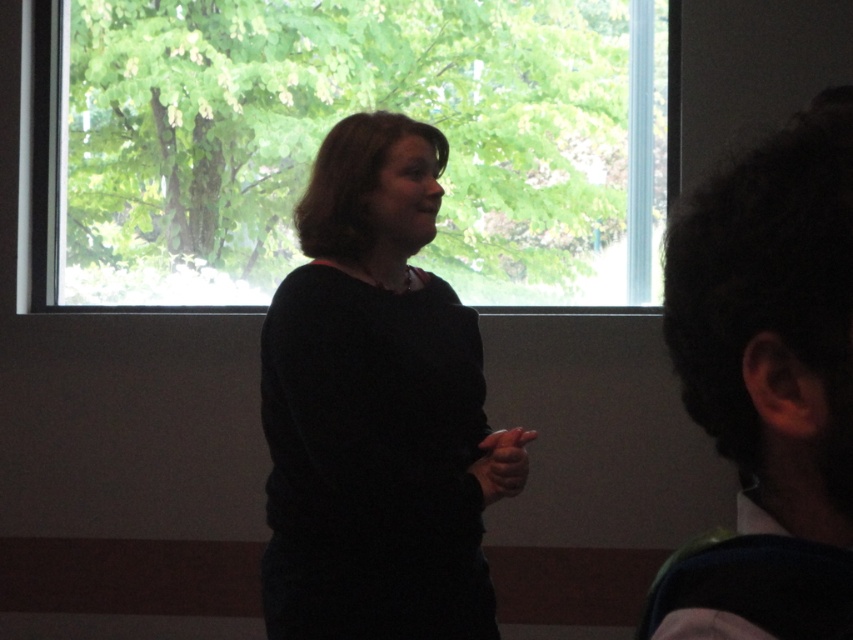
Does black matte sweater at center have a greater width compared to dark curly hair at right?

Yes.

At what (x,y) coordinates should I click in order to perform the action: click on black matte sweater at center. Please return your answer as a coordinate pair (x, y). The height and width of the screenshot is (640, 853). Looking at the image, I should click on point(375,408).

Can you confirm if transparent glass window at upper center is shorter than dark curly hair at right?

No.

Can you confirm if transparent glass window at upper center is positioned to the left of dark curly hair at right?

Correct, you'll find transparent glass window at upper center to the left of dark curly hair at right.

Between point (105, 160) and point (763, 176), which one is positioned behind?

Positioned behind is point (105, 160).

Locate an element on the screen. The height and width of the screenshot is (640, 853). transparent glass window at upper center is located at coordinates (331, 138).

Which is above, transparent glass window at upper center or black matte sweater at center?

Positioned higher is transparent glass window at upper center.

Does transparent glass window at upper center have a lesser height compared to black matte sweater at center?

Incorrect, transparent glass window at upper center's height does not fall short of black matte sweater at center's.

What do you see at coordinates (331, 138) in the screenshot? I see `transparent glass window at upper center` at bounding box center [331, 138].

Where is `transparent glass window at upper center`? The width and height of the screenshot is (853, 640). transparent glass window at upper center is located at coordinates (331, 138).